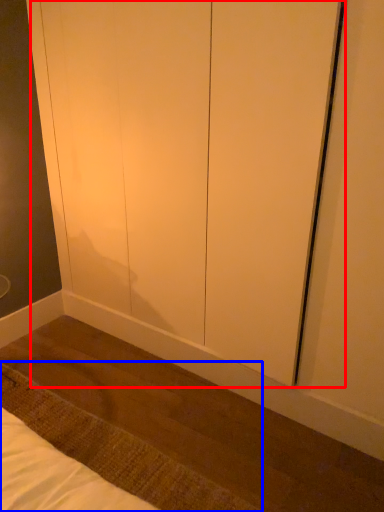
Question: Which point is further to the camera, screen door (highlighted by a red box) or mat (highlighted by a blue box)?

Choices:
 (A) screen door
 (B) mat

Answer: (B)